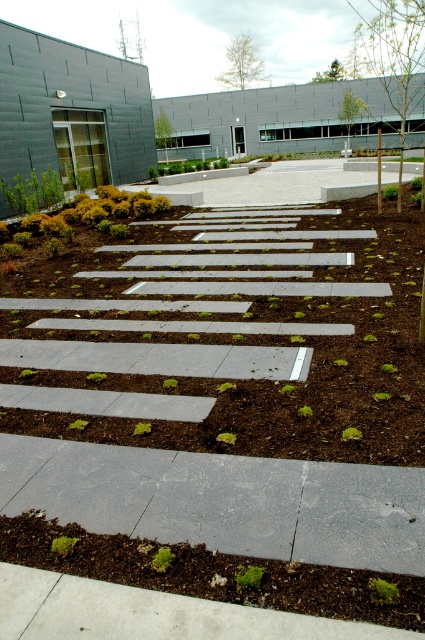
Is brown mulch at center wider than green mulch at lower center?

In fact, brown mulch at center might be narrower than green mulch at lower center.

Measure the distance from brown mulch at center to green mulch at lower center.

They are 4.46 meters apart.

You are a GUI agent. You are given a task and a screenshot of the screen. Output one action in this format:
    pyautogui.click(x=<x>, y=<y>)
    Task: Click on the brown mulch at center
    This screenshot has height=640, width=425.
    Given the screenshot: What is the action you would take?
    pyautogui.click(x=224, y=349)

At what (x,y) coordinates should I click in order to perform the action: click on brown mulch at center. Please return your answer as a coordinate pair (x, y). The width and height of the screenshot is (425, 640). Looking at the image, I should click on (224, 349).